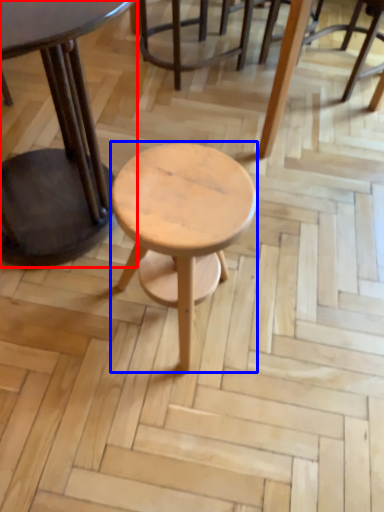
Question: Which object appears farthest to the camera in this image, table (highlighted by a red box) or stool (highlighted by a blue box)?

Choices:
 (A) table
 (B) stool

Answer: (B)